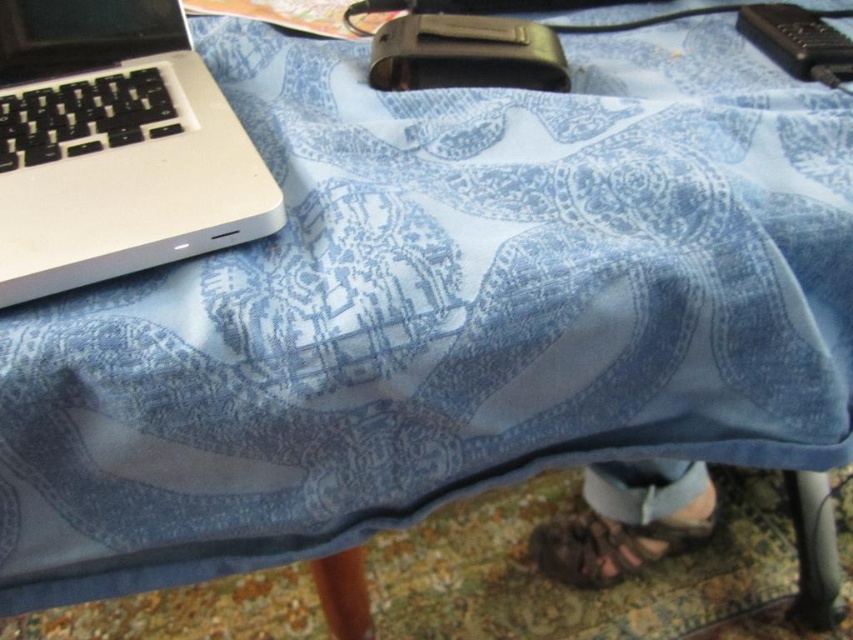
You are organizing items on the table and need to place the white matte laptop at left and the denim pants at lower right. Based on their current positions, which item is closer to the edge of the table?

The denim pants at lower right are closer to the edge of the table since the white matte laptop at left is located above them, meaning the laptop is positioned higher up on the table, while the pants are lower down near the edge.